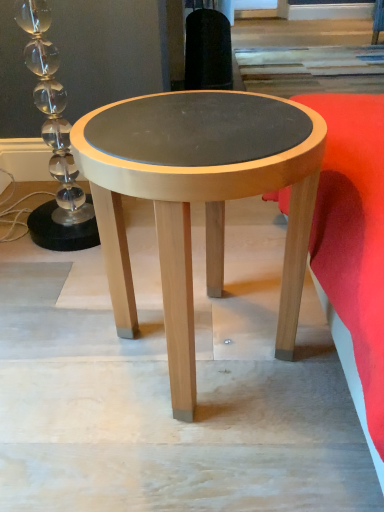
Question: Considering the relative positions of matte wood coffee table at center and velvet red cushion at lower right in the image provided, is matte wood coffee table at center to the left or to the right of velvet red cushion at lower right?

Choices:
 (A) right
 (B) left

Answer: (B)

Question: Is matte wood coffee table at center taller or shorter than velvet red cushion at lower right?

Choices:
 (A) tall
 (B) short

Answer: (A)

Question: From the image's perspective, is matte wood coffee table at center above or below velvet red cushion at lower right?

Choices:
 (A) above
 (B) below

Answer: (B)

Question: In terms of size, does velvet red cushion at lower right appear bigger or smaller than matte wood coffee table at center?

Choices:
 (A) big
 (B) small

Answer: (A)

Question: From their relative heights in the image, would you say velvet red cushion at lower right is taller or shorter than matte wood coffee table at center?

Choices:
 (A) tall
 (B) short

Answer: (B)

Question: Looking at their shapes, would you say velvet red cushion at lower right is wider or thinner than matte wood coffee table at center?

Choices:
 (A) thin
 (B) wide

Answer: (B)

Question: From the image's perspective, is velvet red cushion at lower right positioned above or below matte wood coffee table at center?

Choices:
 (A) above
 (B) below

Answer: (A)